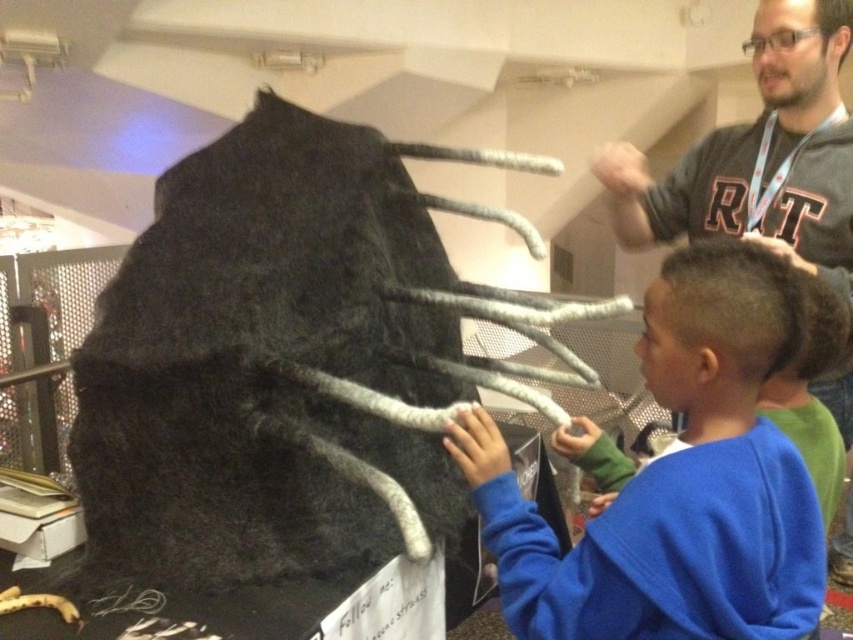
Is blue fleece sweater at center to the right of dark gray sweater at upper right from the viewer's perspective?

No, blue fleece sweater at center is not to the right of dark gray sweater at upper right.

Between blue fleece sweater at center and dark gray sweater at upper right, which one appears on the left side from the viewer's perspective?

blue fleece sweater at center

This screenshot has width=853, height=640. What do you see at coordinates (676, 481) in the screenshot?
I see `blue fleece sweater at center` at bounding box center [676, 481].

Identify the location of blue fleece sweater at center. Image resolution: width=853 pixels, height=640 pixels. (676, 481).